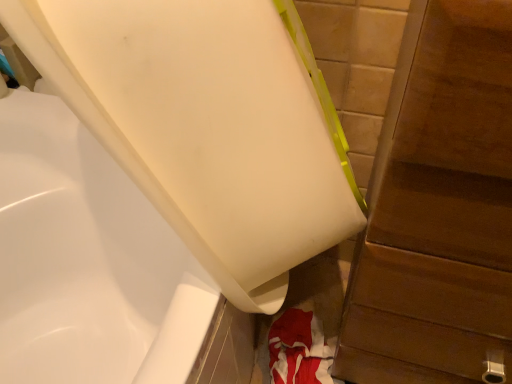
Image resolution: width=512 pixels, height=384 pixels. Describe the element at coordinates (439, 209) in the screenshot. I see `wooden dresser at right` at that location.

This screenshot has height=384, width=512. Identify the location of wooden dresser at right. [439, 209].

At what (x,y) coordinates should I click in order to perform the action: click on white glossy bathtub at lower left. Please return your answer as a coordinate pair (x, y). Looking at the image, I should click on (208, 125).

What do you see at coordinates (208, 125) in the screenshot? The height and width of the screenshot is (384, 512). I see `white glossy bathtub at lower left` at bounding box center [208, 125].

Locate an element on the screen. Image resolution: width=512 pixels, height=384 pixels. wooden dresser at right is located at coordinates (439, 209).

Does wooden dresser at right appear on the right side of white glossy bathtub at lower left?

Yes, wooden dresser at right is to the right of white glossy bathtub at lower left.

Does wooden dresser at right come in front of white glossy bathtub at lower left?

Yes, it is.

Which is less distant, (x=504, y=243) or (x=265, y=267)?

The point (x=504, y=243) is more forward.

From the image's perspective, is wooden dresser at right under white glossy bathtub at lower left?

Yes, from the image's perspective, wooden dresser at right is beneath white glossy bathtub at lower left.

From a real-world perspective, is wooden dresser at right positioned under white glossy bathtub at lower left based on gravity?

Indeed, from a real-world perspective, wooden dresser at right is positioned beneath white glossy bathtub at lower left.

Looking at their sizes, would you say wooden dresser at right is wider or thinner than white glossy bathtub at lower left?

wooden dresser at right is thinner than white glossy bathtub at lower left.

Which of these two, wooden dresser at right or white glossy bathtub at lower left, stands taller?

wooden dresser at right is taller.

Considering the sizes of objects wooden dresser at right and white glossy bathtub at lower left in the image provided, who is bigger, wooden dresser at right or white glossy bathtub at lower left?

wooden dresser at right is bigger.

Which is correct: wooden dresser at right is inside white glossy bathtub at lower left, or outside of it?

wooden dresser at right is located beyond the bounds of white glossy bathtub at lower left.

Is the surface of wooden dresser at right in direct contact with white glossy bathtub at lower left?

No, wooden dresser at right is not in contact with white glossy bathtub at lower left.

Is wooden dresser at right oriented towards white glossy bathtub at lower left?

No.

I want to click on bathtub above the wooden dresser at right (from a real-world perspective), so click(x=208, y=125).

Can you confirm if white glossy bathtub at lower left is positioned to the left of wooden dresser at right?

Indeed, white glossy bathtub at lower left is positioned on the left side of wooden dresser at right.

Between white glossy bathtub at lower left and wooden dresser at right, which one is positioned behind?

white glossy bathtub at lower left is further from the camera.

Is point (212, 231) less distant than point (439, 136)?

No, it is not.

From the image's perspective, which object appears higher, white glossy bathtub at lower left or wooden dresser at right?

white glossy bathtub at lower left is shown above in the image.

From a real-world perspective, is white glossy bathtub at lower left located higher than wooden dresser at right?

Indeed, from a real-world perspective, white glossy bathtub at lower left stands above wooden dresser at right.

Considering the sizes of objects white glossy bathtub at lower left and wooden dresser at right in the image provided, who is wider, white glossy bathtub at lower left or wooden dresser at right?

white glossy bathtub at lower left is wider.

Can you confirm if white glossy bathtub at lower left is taller than wooden dresser at right?

No, white glossy bathtub at lower left is not taller than wooden dresser at right.

Based on their sizes in the image, would you say white glossy bathtub at lower left is bigger or smaller than wooden dresser at right?

In the image, white glossy bathtub at lower left appears to be smaller than wooden dresser at right.

Is white glossy bathtub at lower left located outside wooden dresser at right?

Yes, white glossy bathtub at lower left is outside of wooden dresser at right.

Is white glossy bathtub at lower left beside wooden dresser at right?

There is a gap between white glossy bathtub at lower left and wooden dresser at right.

Is white glossy bathtub at lower left oriented towards wooden dresser at right?

No, white glossy bathtub at lower left is not aimed at wooden dresser at right.

From the picture: Measure the distance from white glossy bathtub at lower left to wooden dresser at right.

white glossy bathtub at lower left and wooden dresser at right are 16.83 centimeters apart.

You are a GUI agent. You are given a task and a screenshot of the screen. Output one action in this format:
    pyautogui.click(x=<x>, y=<y>)
    Task: Click on the dresser on the right of white glossy bathtub at lower left
    Image resolution: width=512 pixels, height=384 pixels.
    Given the screenshot: What is the action you would take?
    point(439,209)

Find the location of a particular element. The height and width of the screenshot is (384, 512). dresser on the right of white glossy bathtub at lower left is located at coordinates (439, 209).

At what (x,y) coordinates should I click in order to perform the action: click on dresser below the white glossy bathtub at lower left (from the image's perspective). Please return your answer as a coordinate pair (x, y). The width and height of the screenshot is (512, 384). Looking at the image, I should click on (439, 209).